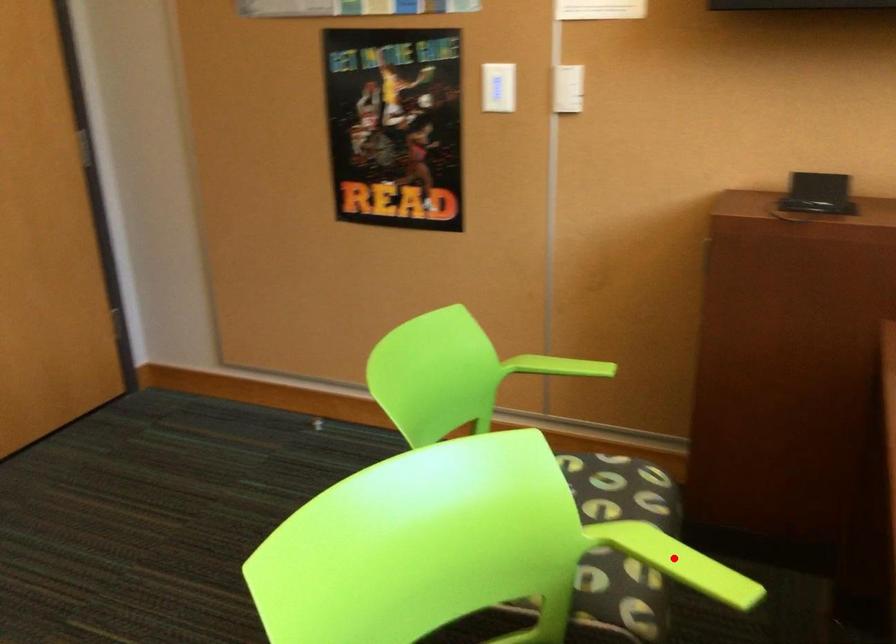
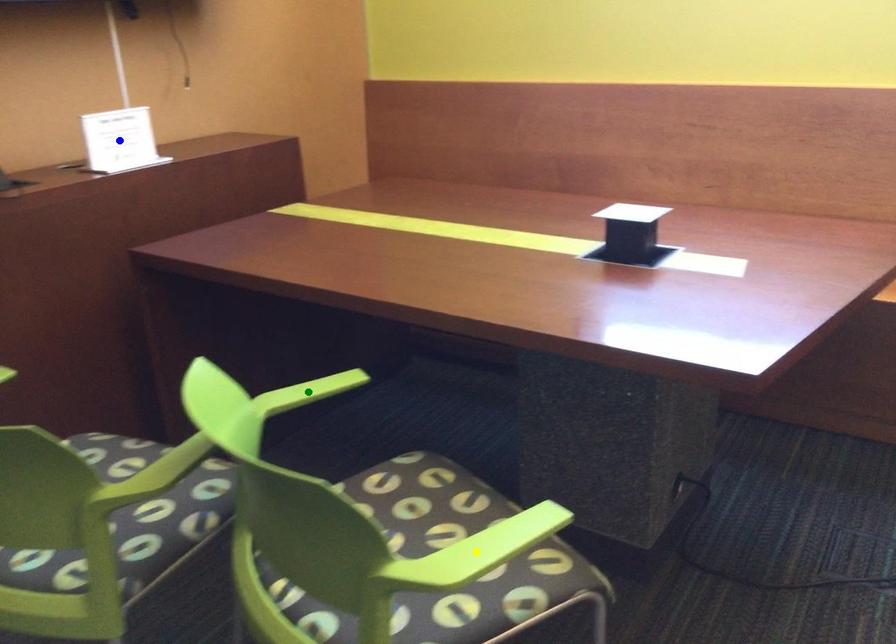
Question: I am providing you with two images of the same scene from different viewpoints. A red point is marked on the first image. You are given multiple points on the second image. In image 2, which mark is for the same physical point as the one in image 1?

Choices:
 (A) green point
 (B) yellow point
 (C) blue point

Answer: (A)